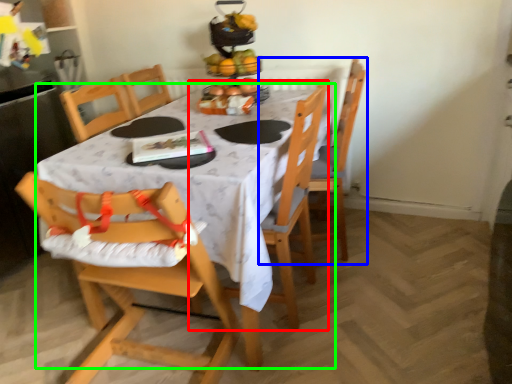
Question: Which object is positioned closest to chair (highlighted by a red box)? Select from chair (highlighted by a blue box) and table (highlighted by a green box).

Choices:
 (A) chair
 (B) table

Answer: (B)